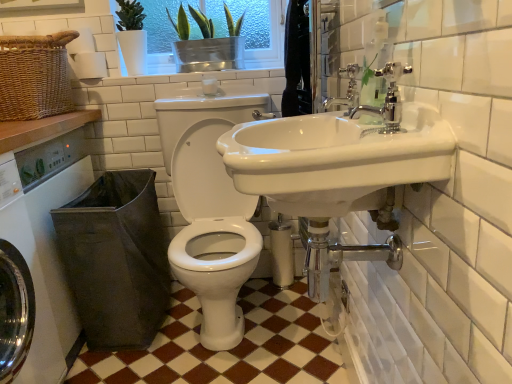
This screenshot has width=512, height=384. In order to click on empty space that is ontop of brown/white checkered floor at center (from a real-world perspective) in this screenshot , I will do `click(203, 340)`.